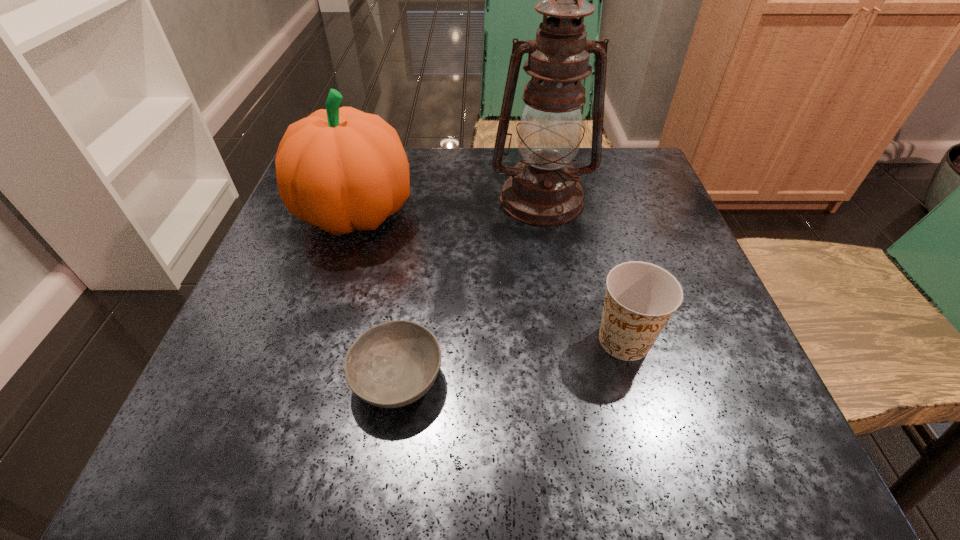
Where is `empty space that is in between the bowl and the third shortest object`? empty space that is in between the bowl and the third shortest object is located at coordinates (376, 296).

Identify the location of unoccupied area between the oil lamp and the pumpkin. point(448,207).

In order to click on object identified as the third closest to the third shortest object in this screenshot , I will do `click(641, 297)`.

Identify which object is the closest to the bowl. Please provide its 2D coordinates. Your answer should be formatted as a tuple, i.e. [(x, y)], where the tuple contains the x and y coordinates of a point satisfying the conditions above.

[(340, 169)]

The height and width of the screenshot is (540, 960). In order to click on vacant space that satisfies the following two spatial constraints: 1. on the front side of the third shortest object; 2. on the right side of the Dixie cup in this screenshot , I will do `click(316, 340)`.

Locate an element on the screen. This screenshot has height=540, width=960. vacant position in the image that satisfies the following two spatial constraints: 1. on the back side of the bowl; 2. on the right side of the oil lamp is located at coordinates (424, 200).